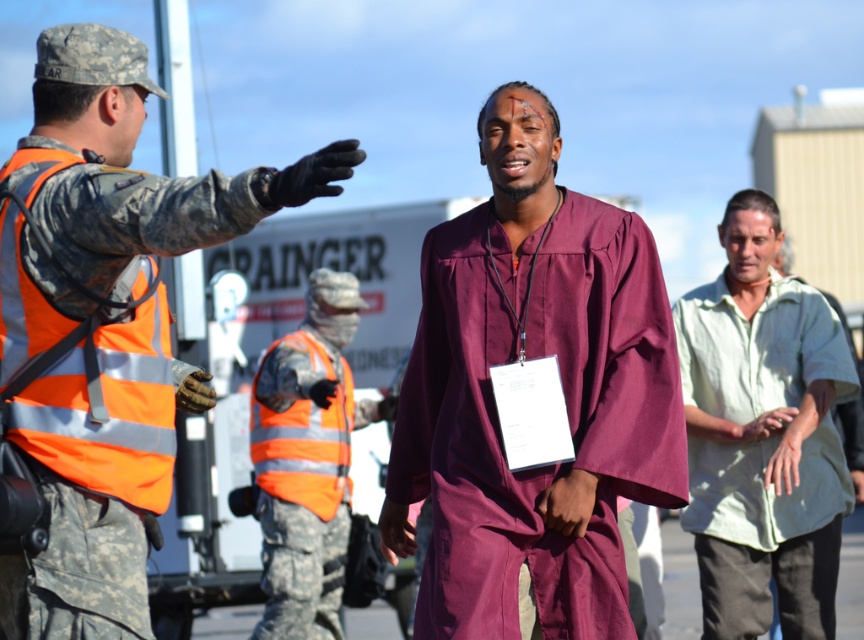
Based on the scene description, which object is taller between the light green cotton shirt at right and the orange reflective safety vest at left?

The light green cotton shirt at right is taller than the orange reflective safety vest at left.